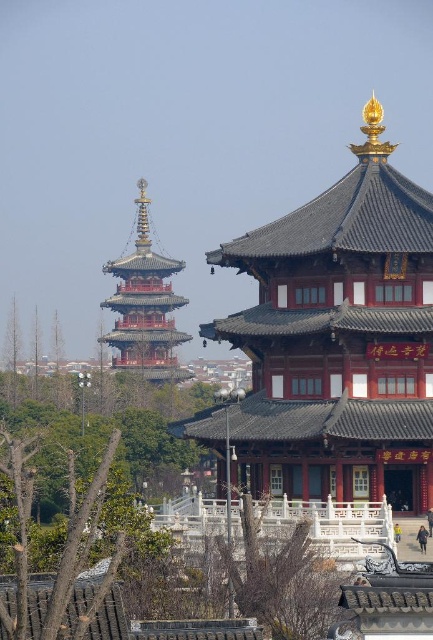
You are standing at the point marked as point (383, 145) in a traditional Chinese architectural scene. You want to take a photo of the pagoda with the golden finial. Is the pagoda within your camera range if your camera has a maximum range of 300 feet?

The distance between you and the pagoda with the golden finial is 288.38 feet, which is within the camera range of 300 feet. Therefore, the pagoda is within your camera range.